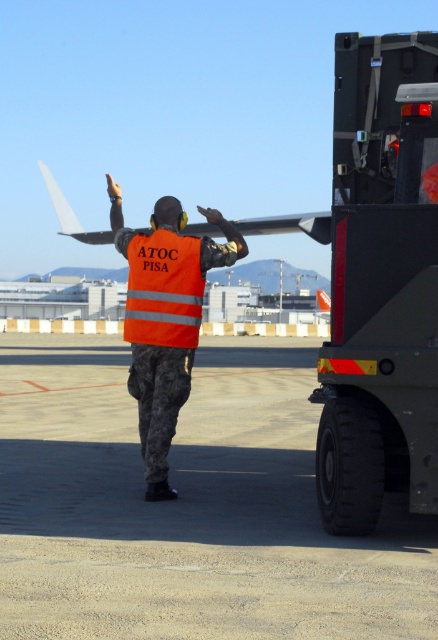
You are a pilot preparing to land your small aircraft at the airport shown. You need to determine where to position yourself relative to the gray asphalt tarmac at lower center and the reflective orange safety vest at center. Based on the scene, which object is wider?

The gray asphalt tarmac at lower center is wider than the reflective orange safety vest at center, so you should align your approach with the wider gray asphalt tarmac at lower center for safe landing.

What is located at the point with coordinates (x=187, y=506) in the image?

The gray asphalt tarmac at lower center is located at point (x=187, y=506).